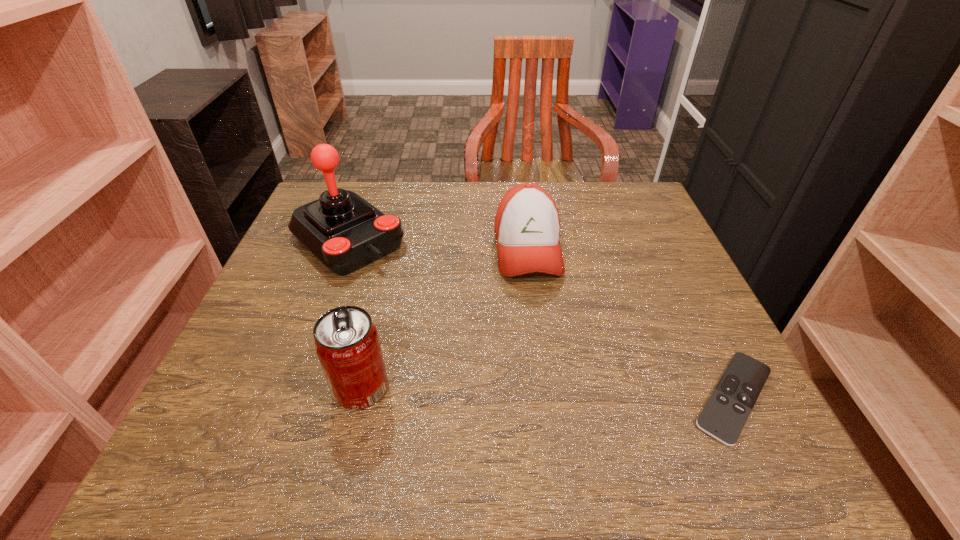
The image size is (960, 540). What are the coordinates of `object that is at the far left corner` in the screenshot? It's located at (345, 232).

What are the coordinates of `object at the near right corner` in the screenshot? It's located at (723, 417).

At what (x,y) coordinates should I click in order to perform the action: click on blank space at the far edge. Please return your answer as a coordinate pair (x, y). Looking at the image, I should click on (560, 188).

The width and height of the screenshot is (960, 540). In the image, there is a desktop. In order to click on vacant space at the near edge in this screenshot , I will do `click(449, 403)`.

In the image, there is a desktop. Identify the location of vacant space at the left edge. (264, 286).

Where is `vacant space at the right edge`? vacant space at the right edge is located at coordinates (683, 260).

The width and height of the screenshot is (960, 540). In the image, there is a desktop. In order to click on free space at the far left corner in this screenshot , I will do `click(374, 182)`.

Where is `blank space at the far right corner of the desktop`? The image size is (960, 540). blank space at the far right corner of the desktop is located at coordinates (644, 187).

Find the location of a particular element. free space between the second object from right to left and the remote control is located at coordinates (631, 323).

This screenshot has height=540, width=960. I want to click on vacant space that's between the joystick and the second shortest object, so click(438, 244).